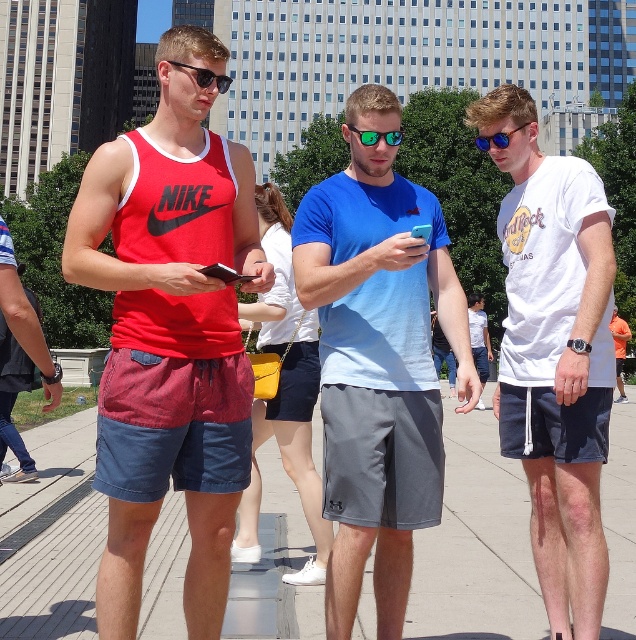
Can you confirm if blue cotton shirt at center is positioned to the left of concrete pavement at center?

In fact, blue cotton shirt at center is to the right of concrete pavement at center.

Is blue cotton shirt at center shorter than concrete pavement at center?

No.

Measure the distance between blue cotton shirt at center and camera.

They are 3.90 meters apart.

Locate an element on the screen. blue cotton shirt at center is located at coordinates (378, 360).

Looking at this image, which is above, matte red tank top at center or orange fabric shirt at center?

matte red tank top at center

Does matte red tank top at center have a lesser height compared to orange fabric shirt at center?

No.

Does point (155, 470) lie in front of point (619, 372)?

Yes, point (155, 470) is in front of point (619, 372).

Identify the location of matte red tank top at center. (170, 333).

Between white cotton t-shirt at center and orange fabric shirt at center, which one is positioned higher?

white cotton t-shirt at center is higher up.

Who is more forward, (515, 372) or (619, 326)?

Point (515, 372) is in front.

Find the location of a particular element. white cotton t-shirt at center is located at coordinates (555, 355).